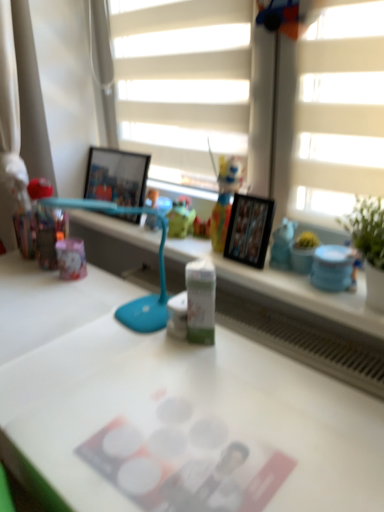
Question: Considering the relative positions of white matte desk at center and teal plastic table lamp at center in the image provided, is white matte desk at center in front of teal plastic table lamp at center?

Choices:
 (A) no
 (B) yes

Answer: (B)

Question: Is white matte desk at center taller than teal plastic table lamp at center?

Choices:
 (A) no
 (B) yes

Answer: (B)

Question: Is white matte desk at center surrounding teal plastic table lamp at center?

Choices:
 (A) no
 (B) yes

Answer: (A)

Question: Does white matte desk at center have a lesser height compared to teal plastic table lamp at center?

Choices:
 (A) yes
 (B) no

Answer: (B)

Question: From a real-world perspective, is white matte desk at center located higher than teal plastic table lamp at center?

Choices:
 (A) yes
 (B) no

Answer: (B)

Question: From the image's perspective, is wooden photo frame at center, the 2th picture frame viewed from the back, above or below translucent plastic toy at center?

Choices:
 (A) above
 (B) below

Answer: (B)

Question: Is wooden photo frame at center, marked as the first picture frame in a right-to-left arrangement, bigger or smaller than translucent plastic toy at center?

Choices:
 (A) small
 (B) big

Answer: (A)

Question: Considering the positions of wooden photo frame at center, which is counted as the 2th picture frame, starting from the top, and translucent plastic toy at center in the image, is wooden photo frame at center, which is counted as the 2th picture frame, starting from the top, wider or thinner than translucent plastic toy at center?

Choices:
 (A) wide
 (B) thin

Answer: (B)

Question: Choose the correct answer: Is wooden photo frame at center, marked as the first picture frame in a right-to-left arrangement, inside translucent plastic toy at center or outside it?

Choices:
 (A) inside
 (B) outside

Answer: (B)

Question: From the image's perspective, is green matte milk carton at center, the 1th stationery when ordered from left to right, located above or below translucent plastic toy at center?

Choices:
 (A) above
 (B) below

Answer: (B)

Question: In terms of size, does green matte milk carton at center, the 1th stationery when ordered from left to right, appear bigger or smaller than translucent plastic toy at center?

Choices:
 (A) big
 (B) small

Answer: (B)

Question: Do you think green matte milk carton at center, placed as the 2th stationery when sorted from right to left, is within translucent plastic toy at center, or outside of it?

Choices:
 (A) outside
 (B) inside

Answer: (A)

Question: From their relative heights in the image, would you say green matte milk carton at center, the 1th stationery when ordered from left to right, is taller or shorter than translucent plastic toy at center?

Choices:
 (A) tall
 (B) short

Answer: (B)

Question: Based on their sizes in the image, would you say green matte milk carton at center, placed as the 2th stationery when sorted from right to left, is bigger or smaller than white matte blind at upper center?

Choices:
 (A) small
 (B) big

Answer: (A)

Question: Would you say green matte milk carton at center, the 1th stationery when ordered from left to right, is to the left or to the right of white matte blind at upper center in the picture?

Choices:
 (A) right
 (B) left

Answer: (A)